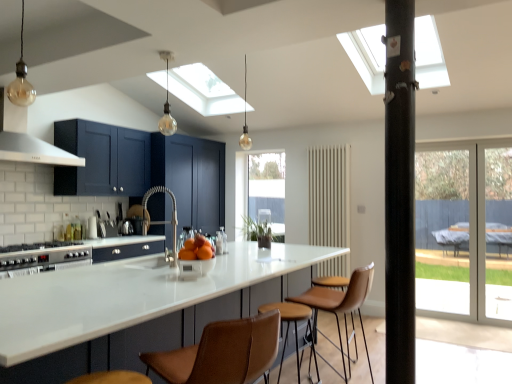
Question: Is clear glass window at center inside translucent glass bulb at center, which appears as the first light fixture when viewed from the back?

Choices:
 (A) no
 (B) yes

Answer: (A)

Question: From the image's perspective, is translucent glass bulb at center, which appears as the first light fixture when viewed from the back, on top of clear glass window at center?

Choices:
 (A) no
 (B) yes

Answer: (B)

Question: From a real-world perspective, is translucent glass bulb at center, marked as the 3th light fixture in a left-to-right arrangement, on top of clear glass window at center?

Choices:
 (A) yes
 (B) no

Answer: (A)

Question: Can you confirm if translucent glass bulb at center, which is counted as the third light fixture, starting from the front, is shorter than clear glass window at center?

Choices:
 (A) yes
 (B) no

Answer: (A)

Question: Is translucent glass bulb at center, marked as the 3th light fixture in a left-to-right arrangement, oriented towards clear glass window at center?

Choices:
 (A) no
 (B) yes

Answer: (A)

Question: From the image's perspective, is clear glass window at center positioned above or below transparent glass screen door at right, the 2th screen door in the left-to-right sequence?

Choices:
 (A) above
 (B) below

Answer: (A)

Question: From a real-world perspective, is clear glass window at center physically located above or below transparent glass screen door at right, the 2th screen door in the left-to-right sequence?

Choices:
 (A) below
 (B) above

Answer: (B)

Question: Is clear glass window at center wider or thinner than transparent glass screen door at right, which is the first screen door from right to left?

Choices:
 (A) wide
 (B) thin

Answer: (B)

Question: Based on their sizes in the image, would you say clear glass window at center is bigger or smaller than transparent glass screen door at right, which is the first screen door from right to left?

Choices:
 (A) big
 (B) small

Answer: (B)

Question: Looking at their shapes, would you say translucent glass bulb at upper center, acting as the second light fixture starting from the left, is wider or thinner than clear glass window at center?

Choices:
 (A) wide
 (B) thin

Answer: (A)

Question: Based on their sizes in the image, would you say translucent glass bulb at upper center, acting as the second light fixture starting from the front, is bigger or smaller than clear glass window at center?

Choices:
 (A) big
 (B) small

Answer: (B)

Question: Is translucent glass bulb at upper center, acting as the second light fixture starting from the front, in front of or behind clear glass window at center in the image?

Choices:
 (A) behind
 (B) front

Answer: (B)

Question: Considering the relative positions of translucent glass bulb at upper center, which is counted as the 2th light fixture, starting from the back, and clear glass window at center in the image provided, is translucent glass bulb at upper center, which is counted as the 2th light fixture, starting from the back, to the left or to the right of clear glass window at center?

Choices:
 (A) right
 (B) left

Answer: (B)

Question: From the image's perspective, is satin nickel faucet at center above or below orangesmoothbowl at center?

Choices:
 (A) above
 (B) below

Answer: (A)

Question: Based on their sizes in the image, would you say satin nickel faucet at center is bigger or smaller than orangesmoothbowl at center?

Choices:
 (A) small
 (B) big

Answer: (B)